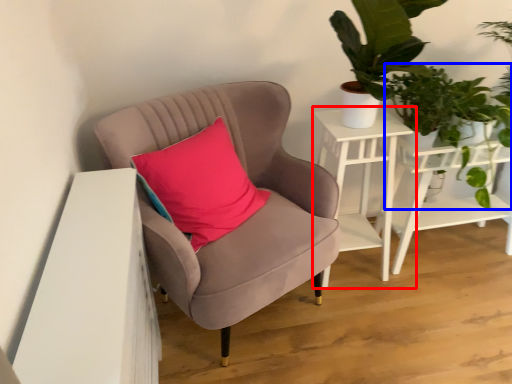
Question: Which point is closer to the camera, table (highlighted by a red box) or vegetation (highlighted by a blue box)?

Choices:
 (A) table
 (B) vegetation

Answer: (B)